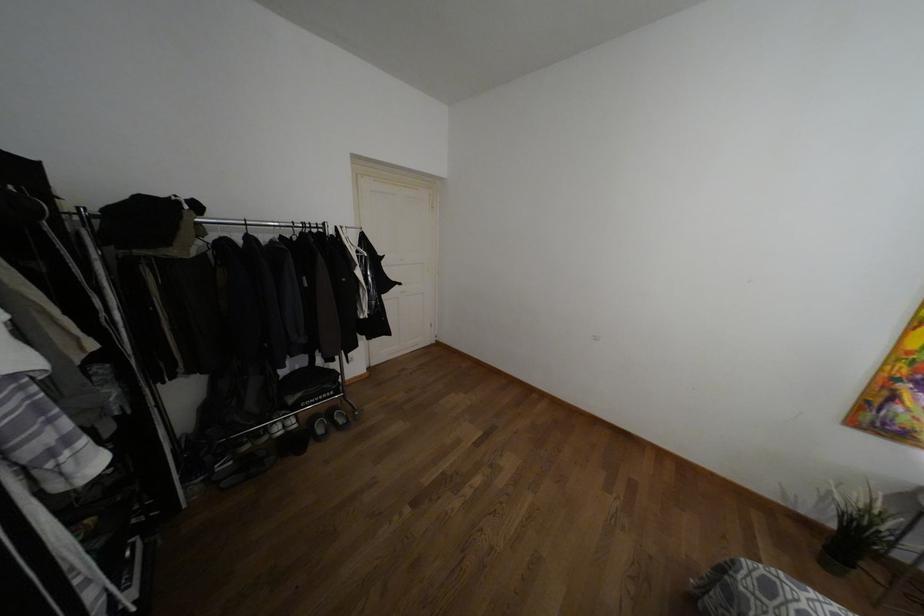
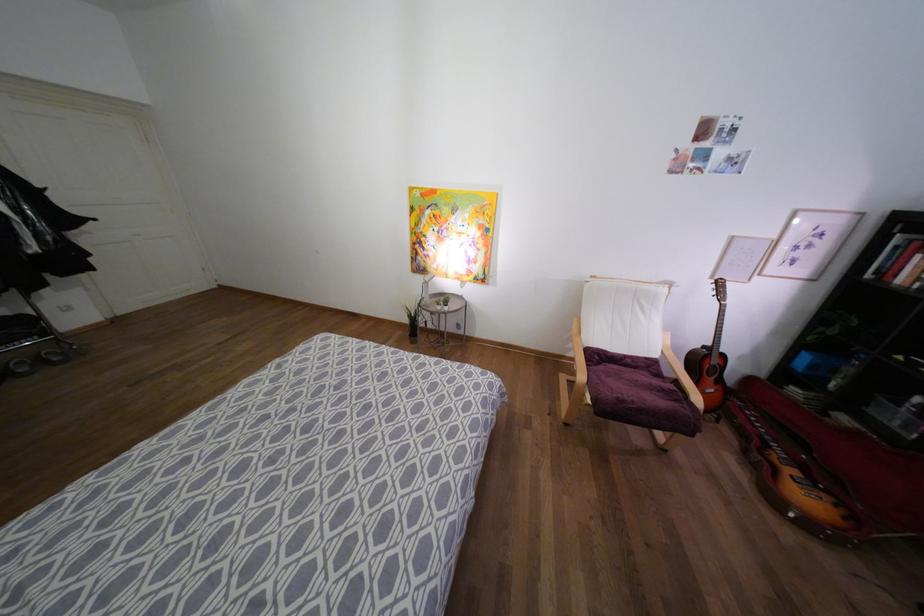
The images are taken continuously from a first-person perspective. In which direction are you moving?

The cameraman walked toward right, backward.